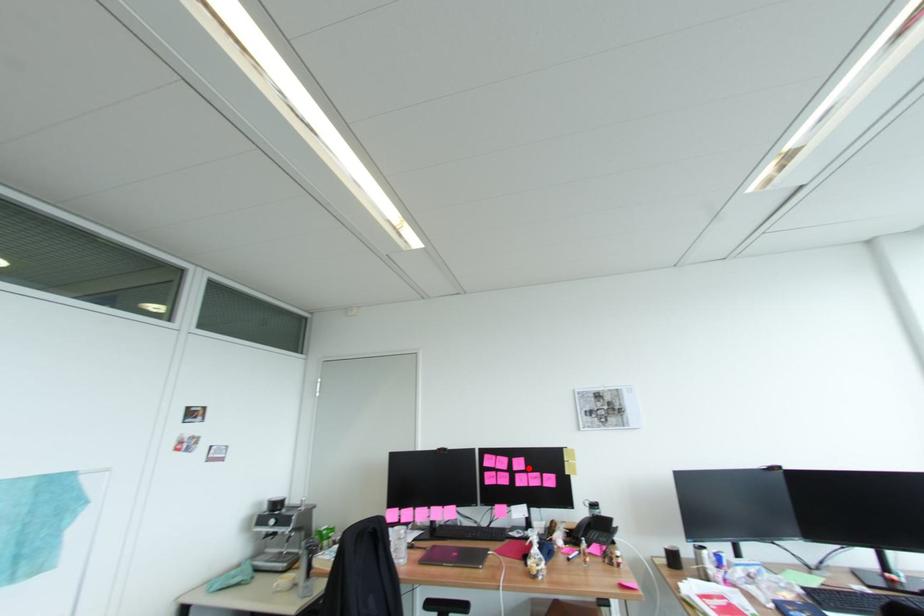
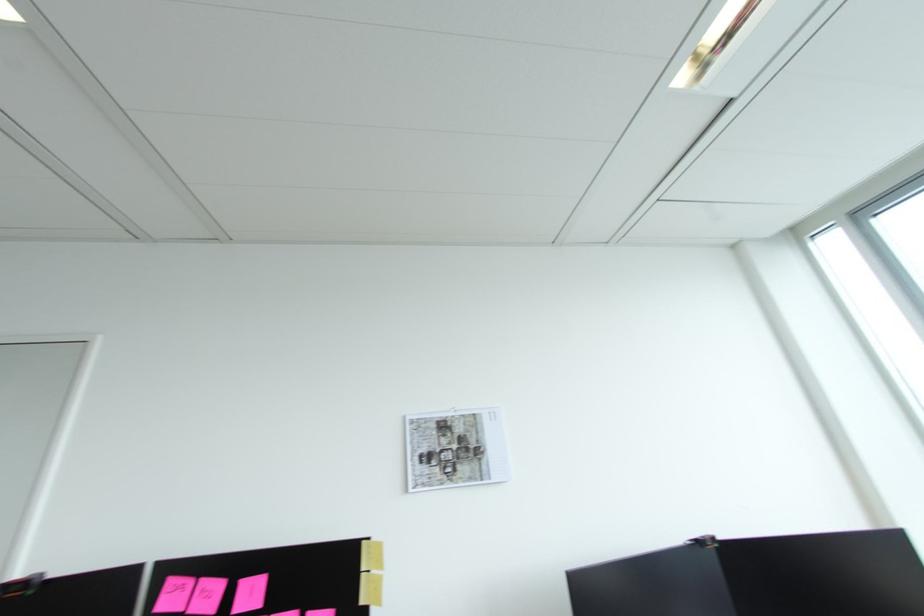
Question: I am providing you with two images of the same scene from different viewpoints. A red point is marked on the first image. At the location where the point appears in image 1, is it still visible in image 2?

Choices:
 (A) Yes
 (B) No

Answer: (A)